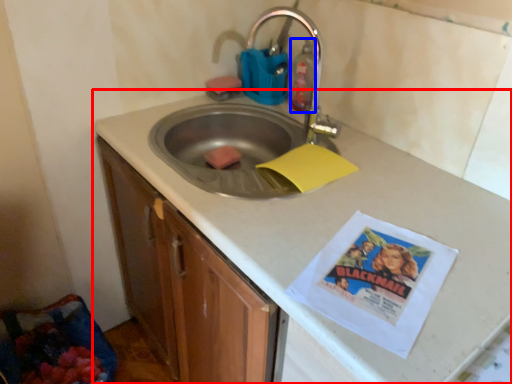
Question: Which of the following is the closest to the observer, countertop (highlighted by a red box) or cleaning product (highlighted by a blue box)?

Choices:
 (A) countertop
 (B) cleaning product

Answer: (A)